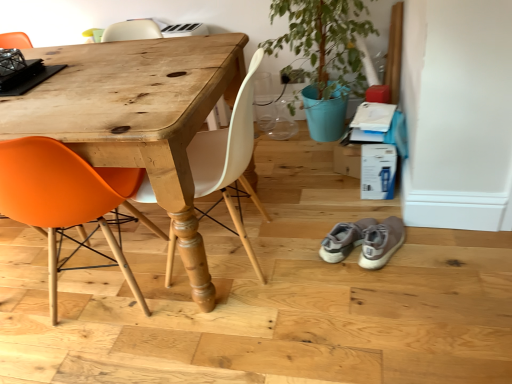
Question: Is orange matte chair at left, which is the 1th chair in left-to-right order, facing away from matte white chair at center, arranged as the 1th chair when viewed from the right?

Choices:
 (A) no
 (B) yes

Answer: (A)

Question: From a real-world perspective, is orange matte chair at left, which is the 1th chair in left-to-right order, below matte white chair at center, arranged as the 1th chair when viewed from the right?

Choices:
 (A) yes
 (B) no

Answer: (A)

Question: Is orange matte chair at left, which is the second chair in right-to-left order, far from matte white chair at center, arranged as the 1th chair when viewed from the right?

Choices:
 (A) yes
 (B) no

Answer: (B)

Question: Is orange matte chair at left, which is the 1th chair in left-to-right order, closer to the viewer compared to matte white chair at center, arranged as the 1th chair when viewed from the right?

Choices:
 (A) yes
 (B) no

Answer: (A)

Question: From a real-world perspective, does orange matte chair at left, which is the second chair in right-to-left order, stand above matte white chair at center, the 2th chair viewed from the left?

Choices:
 (A) no
 (B) yes

Answer: (A)

Question: Does orange matte chair at left, which is the 1th chair in left-to-right order, touch matte white chair at center, the 2th chair viewed from the left?

Choices:
 (A) yes
 (B) no

Answer: (B)

Question: From the image's perspective, is green matte potted plant at upper right beneath orange matte chair at left, which is the second chair in right-to-left order?

Choices:
 (A) yes
 (B) no

Answer: (B)

Question: Does green matte potted plant at upper right turn towards orange matte chair at left, which is the 1th chair in left-to-right order?

Choices:
 (A) no
 (B) yes

Answer: (A)

Question: Is green matte potted plant at upper right bigger than orange matte chair at left, which is the second chair in right-to-left order?

Choices:
 (A) yes
 (B) no

Answer: (A)

Question: Considering the relative sizes of green matte potted plant at upper right and orange matte chair at left, which is the second chair in right-to-left order, in the image provided, is green matte potted plant at upper right smaller than orange matte chair at left, which is the second chair in right-to-left order,?

Choices:
 (A) no
 (B) yes

Answer: (A)

Question: Is green matte potted plant at upper right turned away from orange matte chair at left, which is the 1th chair in left-to-right order?

Choices:
 (A) no
 (B) yes

Answer: (A)

Question: Is green matte potted plant at upper right far away from orange matte chair at left, which is the second chair in right-to-left order?

Choices:
 (A) no
 (B) yes

Answer: (B)

Question: From the image's perspective, is green matte potted plant at upper right located beneath matte white chair at center, arranged as the 1th chair when viewed from the right?

Choices:
 (A) yes
 (B) no

Answer: (B)